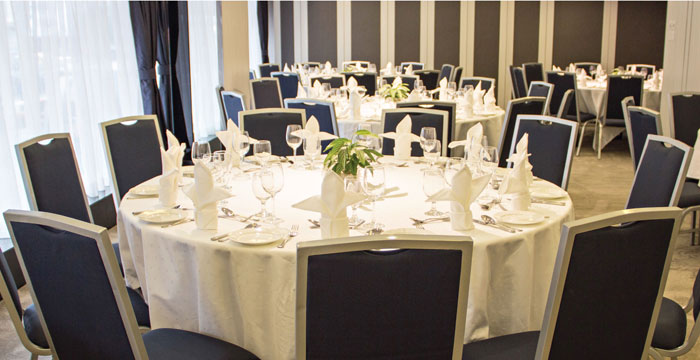
What are the coordinates of `tables` in the screenshot? It's located at (407, 209), (378, 106), (605, 85), (334, 72).